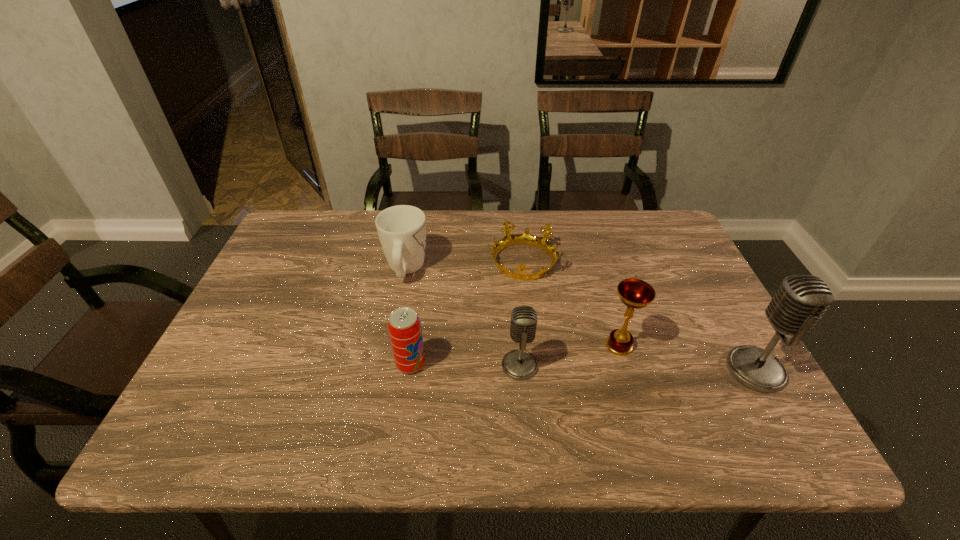
Where is `vacant spot to place a microphone on the left`? vacant spot to place a microphone on the left is located at coordinates (288, 362).